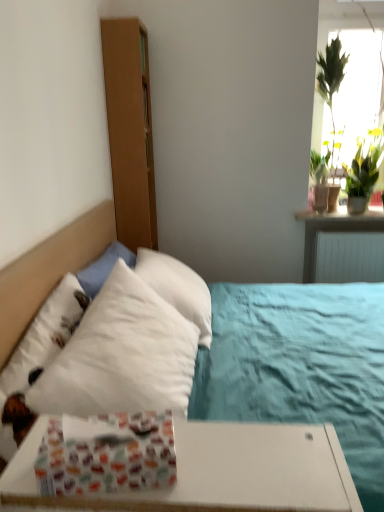
Question: Which is correct: patterned paper gift wrap at lower left is inside white soft bed at left, or outside of it?

Choices:
 (A) outside
 (B) inside

Answer: (A)

Question: Is point (137, 463) positioned closer to the camera than point (44, 279)?

Choices:
 (A) farther
 (B) closer

Answer: (B)

Question: From their relative heights in the image, would you say patterned paper gift wrap at lower left is taller or shorter than white soft bed at left?

Choices:
 (A) short
 (B) tall

Answer: (A)

Question: From a real-world perspective, is white soft bed at left positioned above or below patterned paper gift wrap at lower left?

Choices:
 (A) below
 (B) above

Answer: (A)

Question: Based on their sizes in the image, would you say white soft bed at left is bigger or smaller than patterned paper gift wrap at lower left?

Choices:
 (A) small
 (B) big

Answer: (B)

Question: Does point (36, 278) appear closer or farther from the camera than point (165, 481)?

Choices:
 (A) closer
 (B) farther

Answer: (B)

Question: From the image's perspective, relative to patterned paper gift wrap at lower left, is white soft bed at left above or below?

Choices:
 (A) below
 (B) above

Answer: (B)